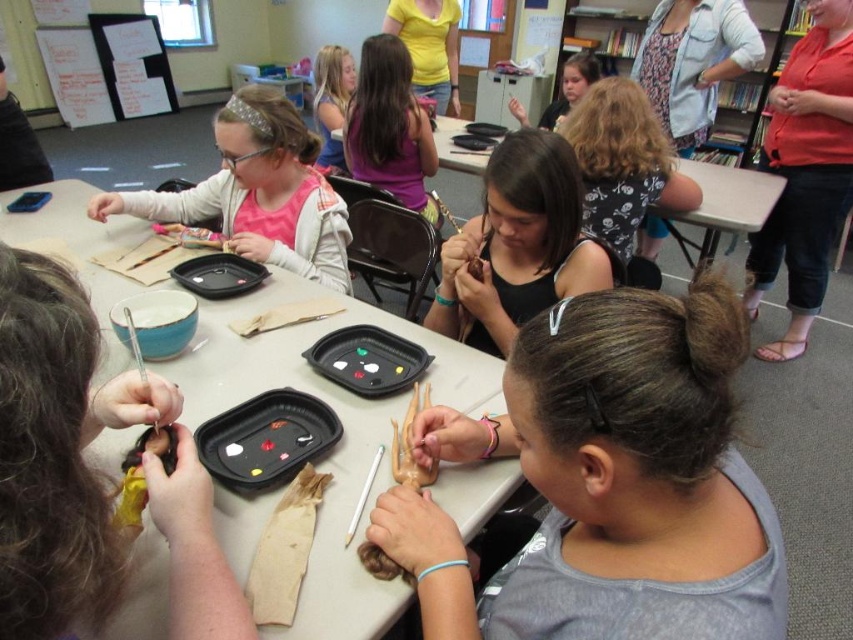
Is point (268, 355) more distant than point (395, 458)?

Yes, point (268, 355) is behind point (395, 458).

Can you confirm if matte plastic table at center is wider than brown matte clay hand at center?

Indeed, matte plastic table at center has a greater width compared to brown matte clay hand at center.

Is point (486, 470) positioned before point (409, 472)?

That is False.

The image size is (853, 640). What are the coordinates of `matte plastic table at center` in the screenshot? It's located at (326, 465).

How distant is purple matte shirt at center from matte pink shirt at upper left?

They are 13.31 inches apart.

Which of these two, purple matte shirt at center or matte pink shirt at upper left, stands shorter?

With less height is matte pink shirt at upper left.

You are a GUI agent. You are given a task and a screenshot of the screen. Output one action in this format:
    pyautogui.click(x=<x>, y=<y>)
    Task: Click on the purple matte shirt at center
    The image size is (853, 640).
    Given the screenshot: What is the action you would take?
    pyautogui.click(x=389, y=125)

How far apart are matte black doll at lower left and yellow fabric doll at lower left?

A distance of 7.51 inches exists between matte black doll at lower left and yellow fabric doll at lower left.

Can you confirm if matte black doll at lower left is wider than yellow fabric doll at lower left?

Correct, the width of matte black doll at lower left exceeds that of yellow fabric doll at lower left.

Between point (10, 342) and point (135, 515), which one is positioned in front?

Point (10, 342)

Locate an element on the screen. The width and height of the screenshot is (853, 640). matte black doll at lower left is located at coordinates (88, 474).